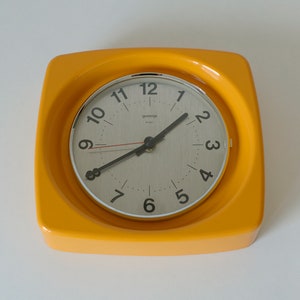
Locate an element on the screen. The width and height of the screenshot is (300, 300). lower right corner of clock is located at coordinates (256, 223).